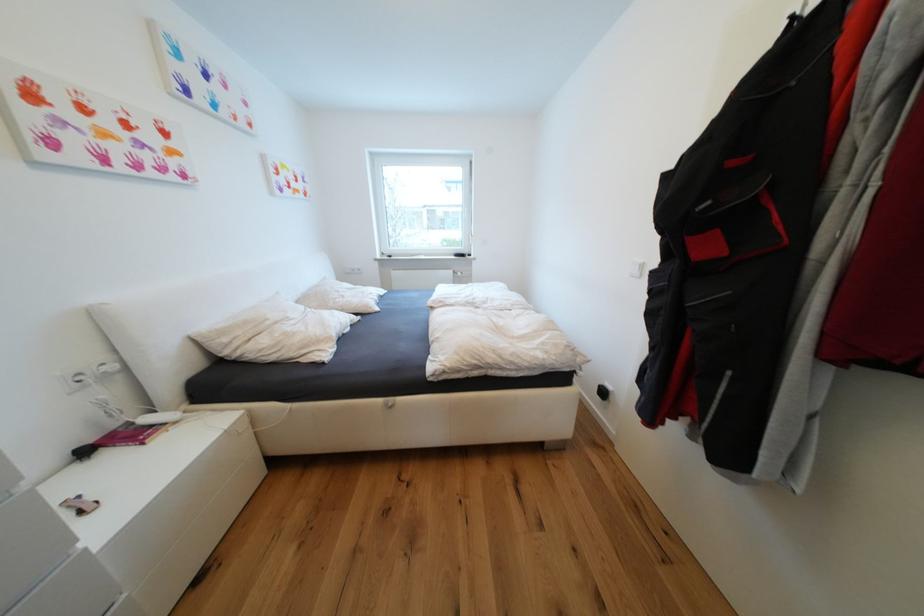
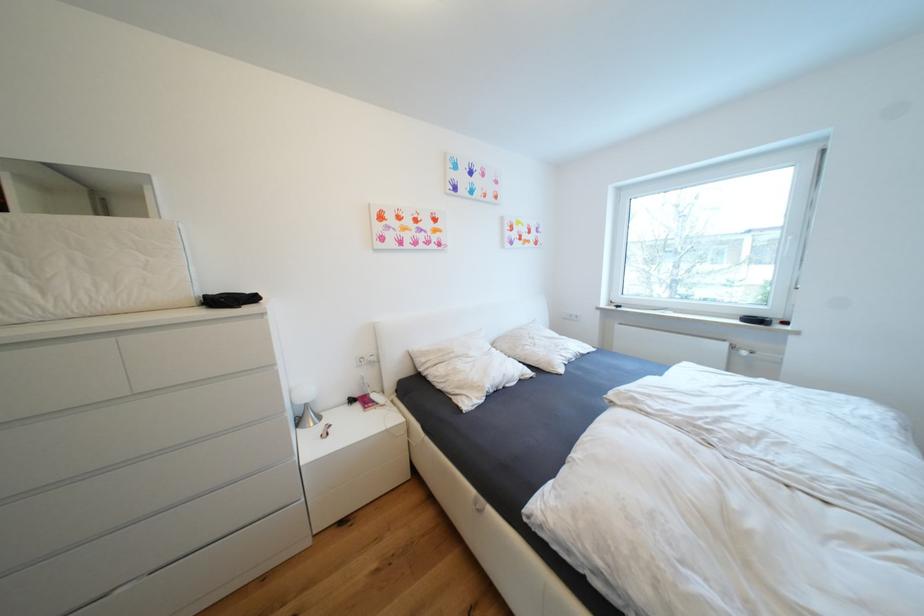
The point at (458, 273) is marked in the first image. Where is the corresponding point in the second image?

(733, 346)